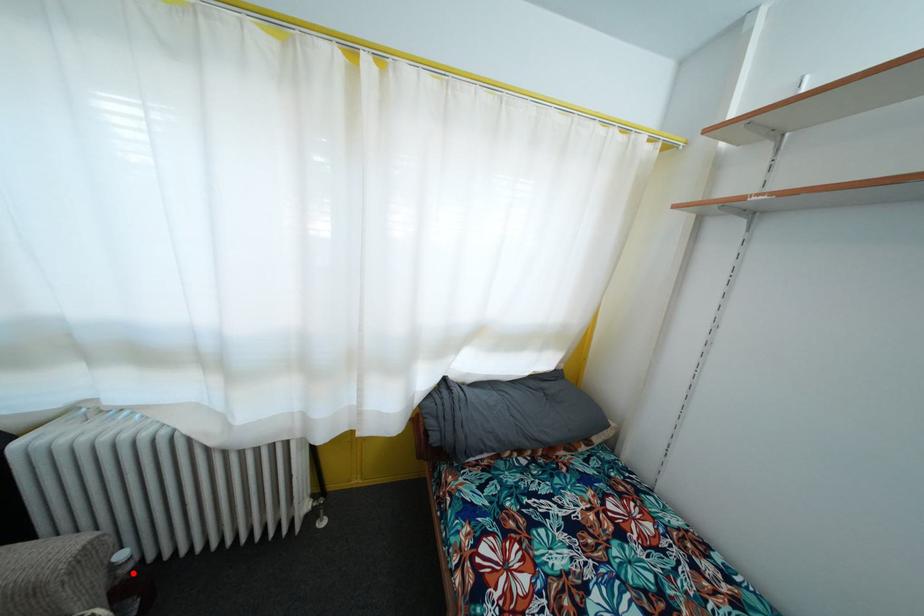
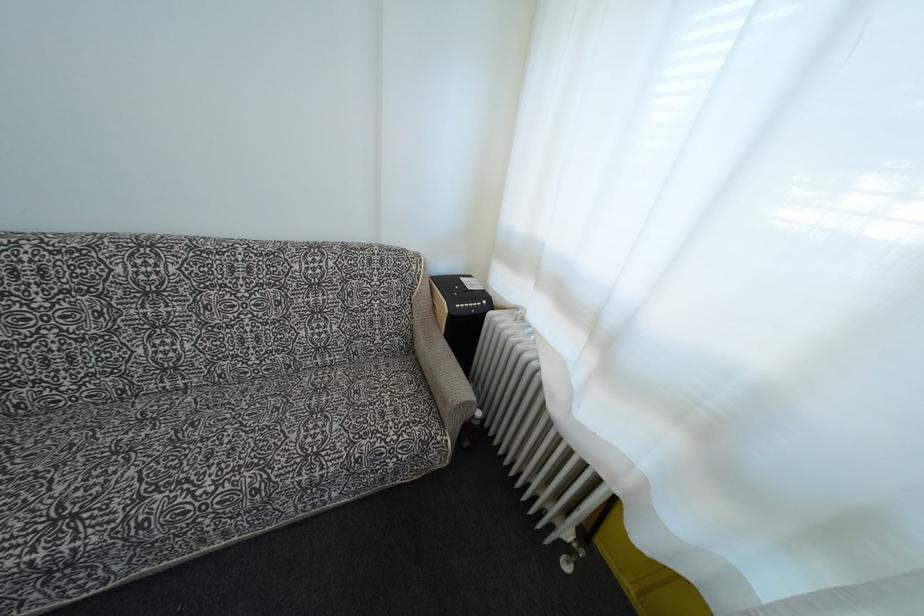
Find the pixel in the second image that matches the highlighted location in the first image.

(480, 429)